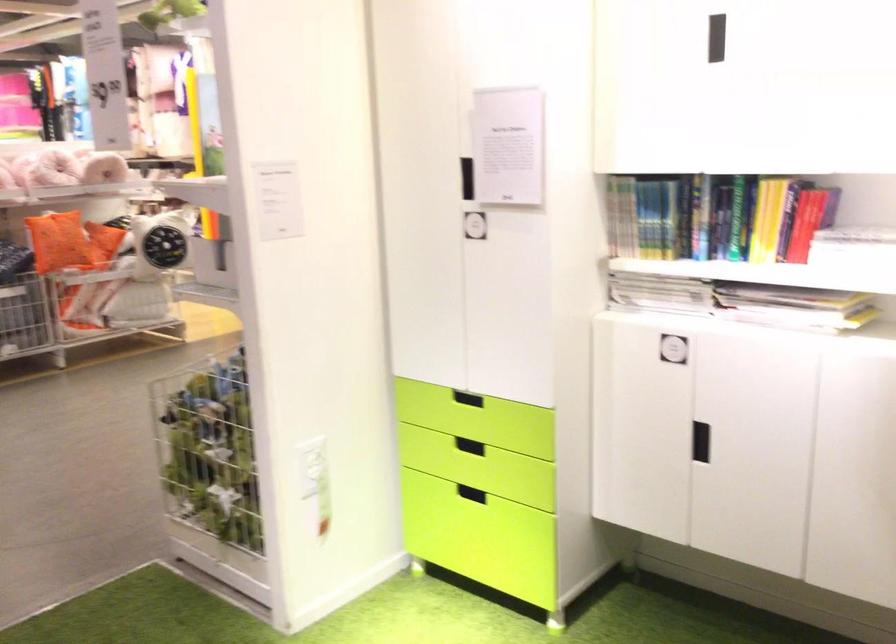
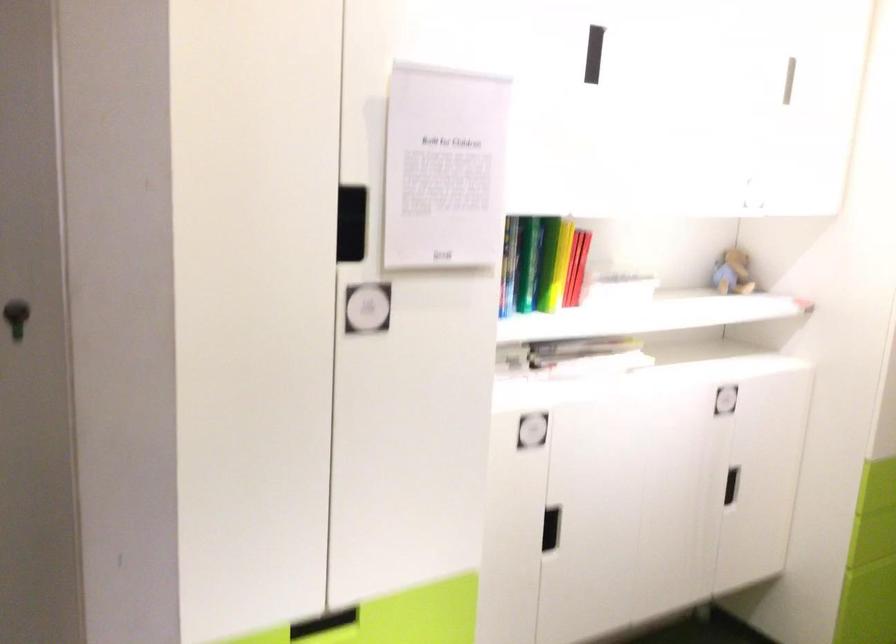
In the second image, find the point that corresponds to (x=532, y=426) in the first image.

(323, 623)